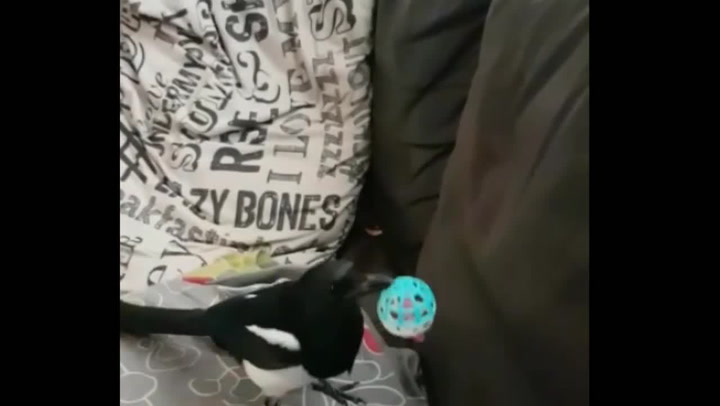
Find the location of a particular element. gray and white patterned couch seat cushion is located at coordinates (173, 378).